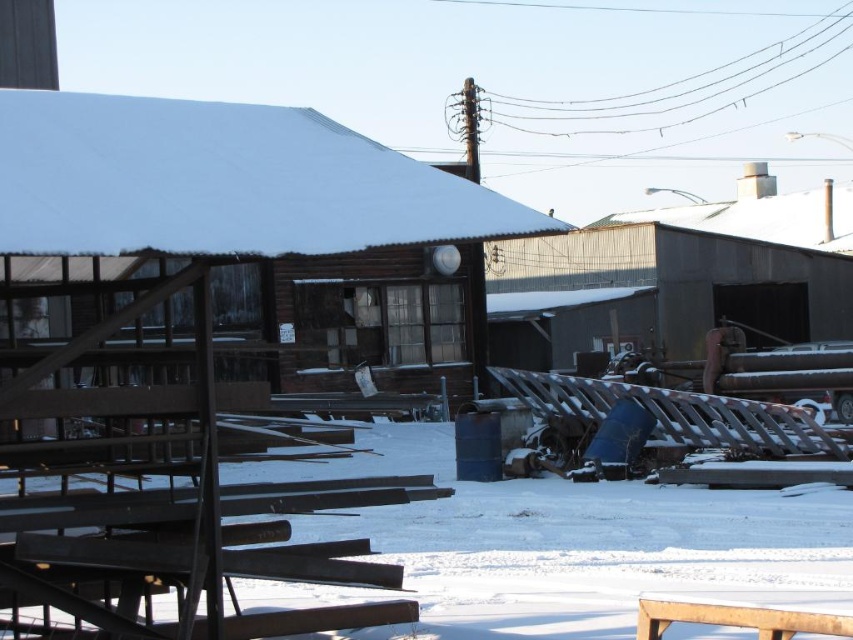
Question: Is white powdery snow at center to the right of brown wooden hut at center from the viewer's perspective?

Choices:
 (A) no
 (B) yes

Answer: (B)

Question: Which of the following is the closest to the observer?

Choices:
 (A) (x=10, y=168)
 (B) (x=581, y=573)

Answer: (A)

Question: Which point is closer to the camera taking this photo?

Choices:
 (A) (433, 218)
 (B) (796, 572)

Answer: (A)

Question: Which object is closer to the camera taking this photo?

Choices:
 (A) brown wooden hut at center
 (B) white powdery snow at center

Answer: (A)

Question: Is white powdery snow at center bigger than brown wooden hut at center?

Choices:
 (A) no
 (B) yes

Answer: (B)

Question: Is white powdery snow at center below brown wooden hut at center?

Choices:
 (A) yes
 (B) no

Answer: (A)